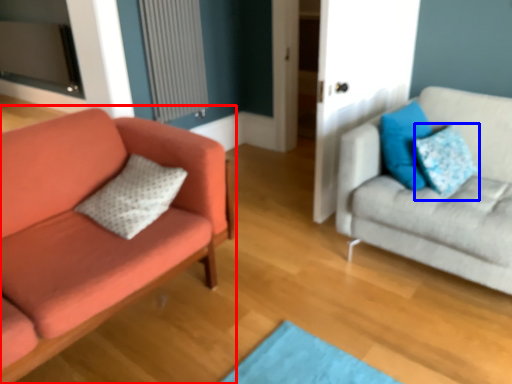
Question: Which point is closer to the camera, studio couch (highlighted by a red box) or pillow (highlighted by a blue box)?

Choices:
 (A) studio couch
 (B) pillow

Answer: (A)